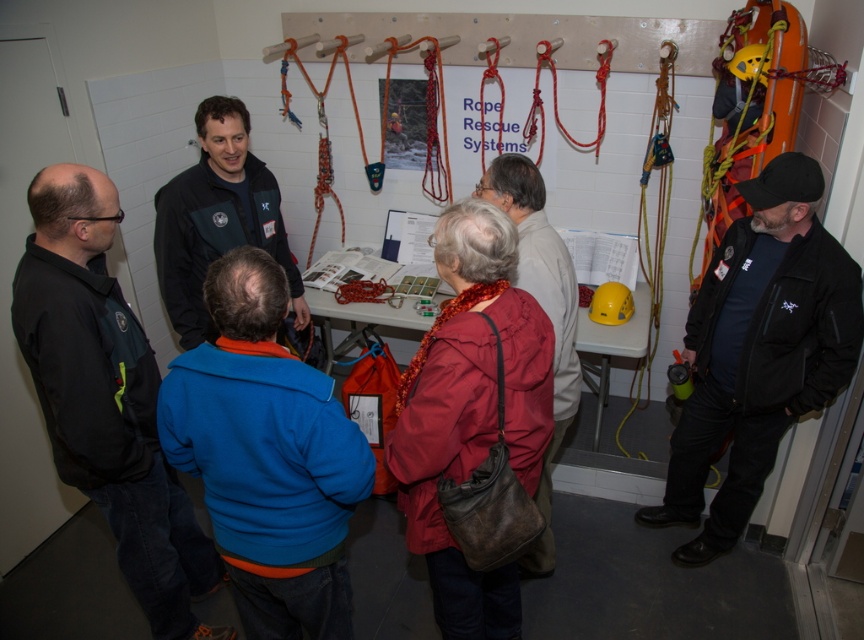
Is point (236, 468) less distant than point (554, 312)?

Yes, it is in front of point (554, 312).

Is blue fleece jacket at center thinner than leather handbag at center?

In fact, blue fleece jacket at center might be wider than leather handbag at center.

Between point (347, 442) and point (545, 275), which one is positioned in front?

Point (347, 442)

The height and width of the screenshot is (640, 864). I want to click on blue fleece jacket at center, so click(x=265, y=456).

Between black leather jacket at right and black matte jacket at center, which one has less height?

With less height is black matte jacket at center.

Is point (684, 561) less distant than point (221, 248)?

No, it is not.

Who is more forward, (735, 266) or (207, 198)?

Point (735, 266) is more forward.

The height and width of the screenshot is (640, 864). What are the coordinates of `black leather jacket at right` in the screenshot? It's located at (758, 352).

Which of these two, black matte jacket at center or yellow matte helmet at center, stands shorter?

yellow matte helmet at center

Is point (232, 198) farther from viewer compared to point (627, 292)?

No, it is in front of (627, 292).

Measure the distance between black matte jacket at center and camera.

black matte jacket at center is 7.95 feet away from camera.

Where is `black matte jacket at center`? This screenshot has height=640, width=864. black matte jacket at center is located at coordinates (217, 220).